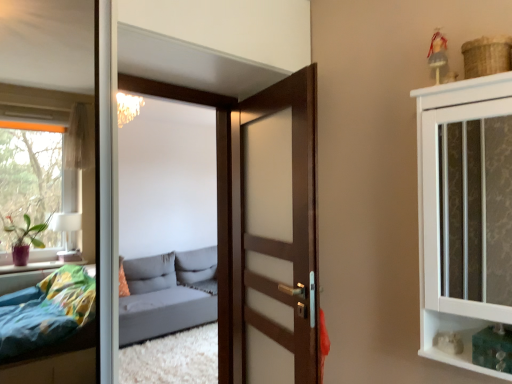
Question: Does wooden door at center have a greater width compared to white textured cabinet at upper right?

Choices:
 (A) yes
 (B) no

Answer: (B)

Question: Considering the relative sizes of wooden door at center and white textured cabinet at upper right in the image provided, is wooden door at center shorter than white textured cabinet at upper right?

Choices:
 (A) yes
 (B) no

Answer: (B)

Question: Does wooden door at center have a lesser width compared to white textured cabinet at upper right?

Choices:
 (A) yes
 (B) no

Answer: (A)

Question: Is wooden door at center touching white textured cabinet at upper right?

Choices:
 (A) yes
 (B) no

Answer: (B)

Question: Is white textured cabinet at upper right at the back of wooden door at center?

Choices:
 (A) yes
 (B) no

Answer: (B)

Question: Considering the positions of gray fabric studio couch at center and white textured cabinet at upper right in the image, is gray fabric studio couch at center bigger or smaller than white textured cabinet at upper right?

Choices:
 (A) small
 (B) big

Answer: (B)

Question: Would you say gray fabric studio couch at center is to the left or to the right of white textured cabinet at upper right in the picture?

Choices:
 (A) right
 (B) left

Answer: (B)

Question: Looking at their shapes, would you say gray fabric studio couch at center is wider or thinner than white textured cabinet at upper right?

Choices:
 (A) thin
 (B) wide

Answer: (B)

Question: Would you say gray fabric studio couch at center is inside or outside white textured cabinet at upper right?

Choices:
 (A) outside
 (B) inside

Answer: (A)

Question: From the image's perspective, is gray fabric studio couch at center above or below wooden door at center?

Choices:
 (A) above
 (B) below

Answer: (B)

Question: From a real-world perspective, is gray fabric studio couch at center physically located above or below wooden door at center?

Choices:
 (A) below
 (B) above

Answer: (A)

Question: Considering the positions of gray fabric studio couch at center and wooden door at center in the image, is gray fabric studio couch at center wider or thinner than wooden door at center?

Choices:
 (A) wide
 (B) thin

Answer: (A)

Question: Is point (194, 379) closer or farther from the camera than point (313, 357)?

Choices:
 (A) closer
 (B) farther

Answer: (B)

Question: From the image's perspective, is wooden door at center above or below gray fabric studio couch at center?

Choices:
 (A) below
 (B) above

Answer: (B)

Question: Considering the positions of wooden door at center and gray fabric studio couch at center in the image, is wooden door at center wider or thinner than gray fabric studio couch at center?

Choices:
 (A) thin
 (B) wide

Answer: (A)